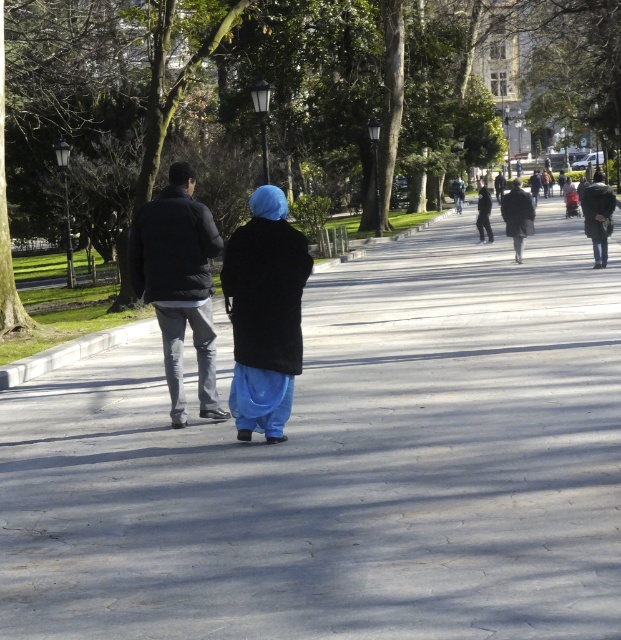
Question: Which of the following is the closest to the observer?

Choices:
 (A) blue matte coat at center
 (B) dark gray coat at center

Answer: (A)

Question: Does blue matte coat at center have a smaller size compared to dark gray coat at center?

Choices:
 (A) no
 (B) yes

Answer: (B)

Question: Is green leafy tree at center wider than dark gray coat at center?

Choices:
 (A) yes
 (B) no

Answer: (A)

Question: Which point is farther to the camera?

Choices:
 (A) (432, 371)
 (B) (514, 250)

Answer: (B)

Question: Does green leafy tree at center lie behind green fabric jacket at center?

Choices:
 (A) no
 (B) yes

Answer: (A)

Question: Which object is positioned farthest from the dark gray coat at right?

Choices:
 (A) blue matte coat at center
 (B) black matte coat at center
 (C) dark gray coat at center
 (D) green fabric jacket at center

Answer: (D)